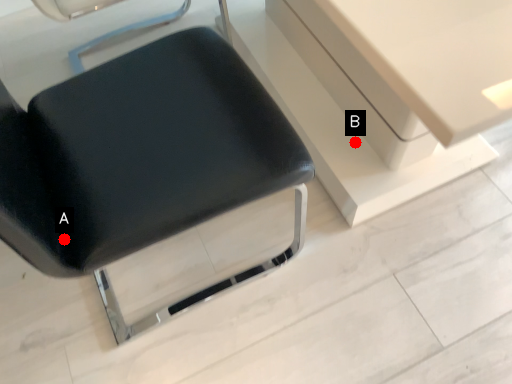
Question: Two points are circled on the image, labeled by A and B beside each circle. Which point is closer to the camera?

Choices:
 (A) A is closer
 (B) B is closer

Answer: (A)